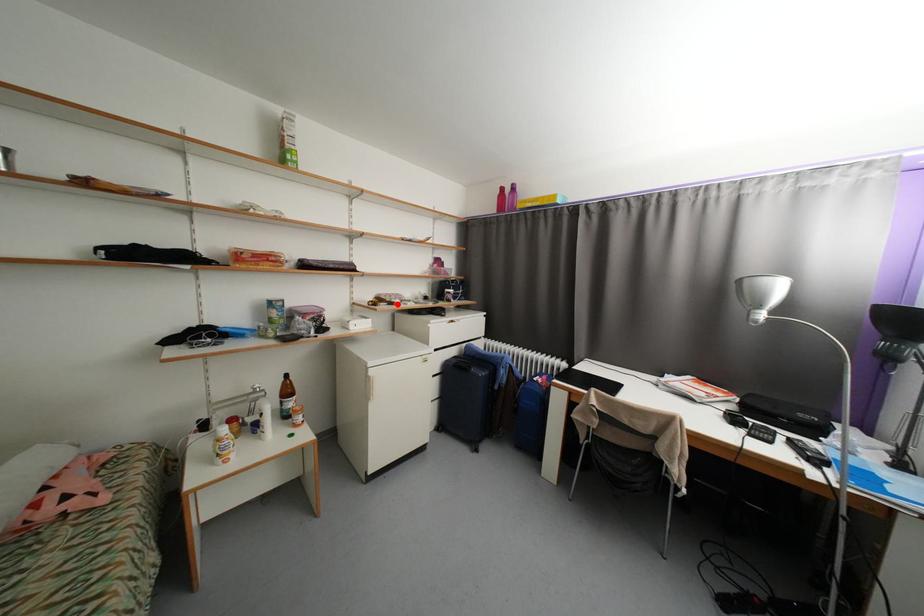
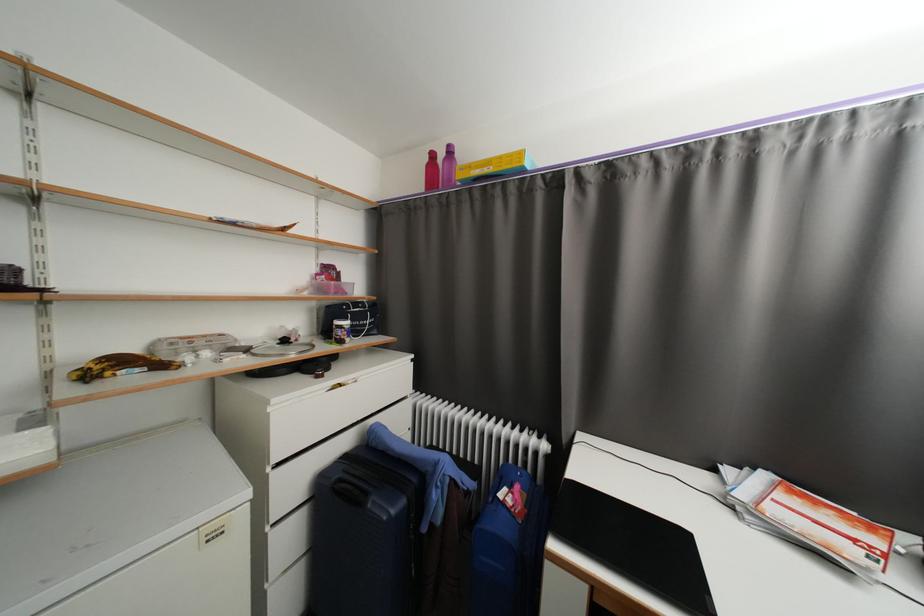
Locate, in the second image, the point that corresponds to the highlighted location in the first image.

(167, 367)